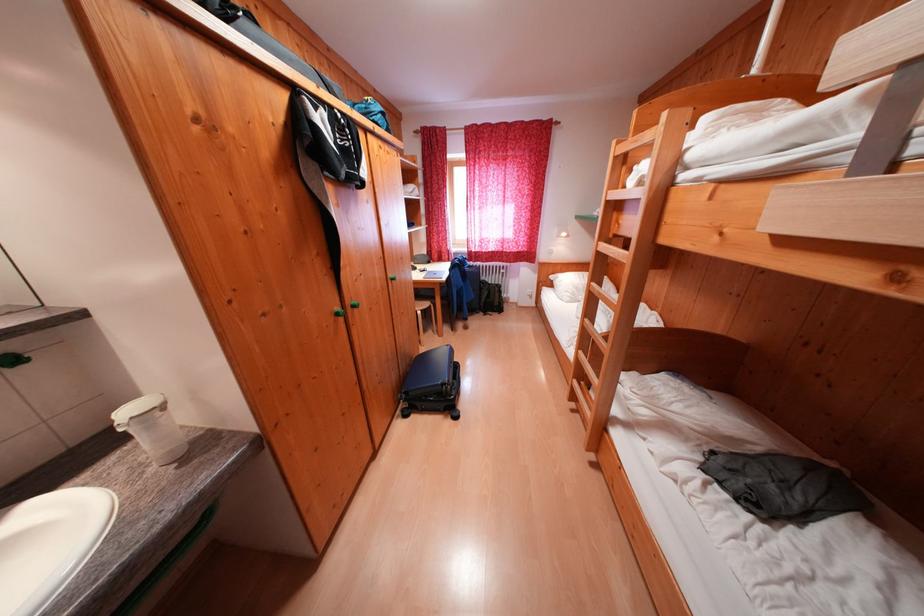
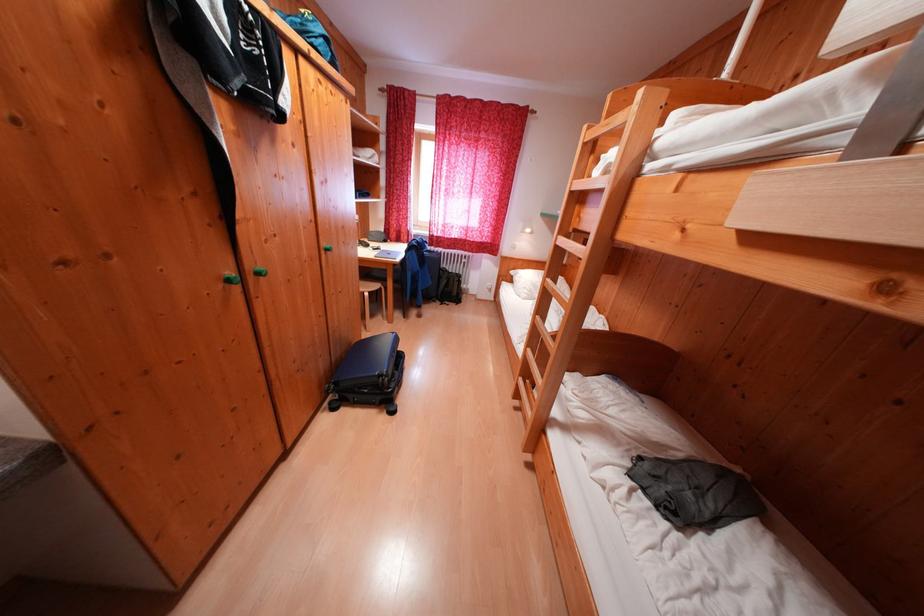
In the second image, find the point that corresponds to pixel 492 286 in the first image.

(454, 275)